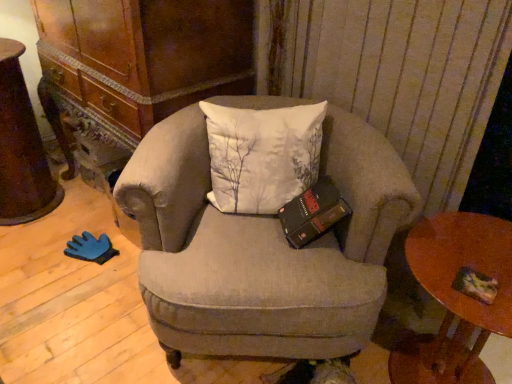
Question: From a real-world perspective, is multicolored paper at lower right under wooden round table at lower right?

Choices:
 (A) no
 (B) yes

Answer: (A)

Question: Is multicolored paper at lower right wider than wooden round table at lower right?

Choices:
 (A) yes
 (B) no

Answer: (B)

Question: Is multicolored paper at lower right thinner than wooden round table at lower right?

Choices:
 (A) no
 (B) yes

Answer: (B)

Question: Is multicolored paper at lower right outside wooden round table at lower right?

Choices:
 (A) no
 (B) yes

Answer: (A)

Question: Does multicolored paper at lower right appear on the left side of wooden round table at lower right?

Choices:
 (A) no
 (B) yes

Answer: (B)

Question: Would you say multicolored paper at lower right is to the left or to the right of rustic wood desk at left in the picture?

Choices:
 (A) right
 (B) left

Answer: (A)

Question: Choose the correct answer: Is multicolored paper at lower right inside rustic wood desk at left or outside it?

Choices:
 (A) outside
 (B) inside

Answer: (A)

Question: From a real-world perspective, relative to rustic wood desk at left, is multicolored paper at lower right vertically above or below?

Choices:
 (A) above
 (B) below

Answer: (A)

Question: Is multicolored paper at lower right in front of or behind rustic wood desk at left in the image?

Choices:
 (A) front
 (B) behind

Answer: (A)

Question: In terms of width, does wooden round table at lower right look wider or thinner when compared to rustic wood desk at left?

Choices:
 (A) thin
 (B) wide

Answer: (B)

Question: Visually, is wooden round table at lower right positioned to the left or to the right of rustic wood desk at left?

Choices:
 (A) left
 (B) right

Answer: (B)

Question: In terms of height, does wooden round table at lower right look taller or shorter compared to rustic wood desk at left?

Choices:
 (A) short
 (B) tall

Answer: (A)

Question: Is point (446, 301) positioned closer to the camera than point (25, 188)?

Choices:
 (A) closer
 (B) farther

Answer: (A)

Question: In terms of height, does textured beige armchair at center look taller or shorter compared to multicolored paper at lower right?

Choices:
 (A) tall
 (B) short

Answer: (A)

Question: From a real-world perspective, is textured beige armchair at center positioned above or below multicolored paper at lower right?

Choices:
 (A) below
 (B) above

Answer: (A)